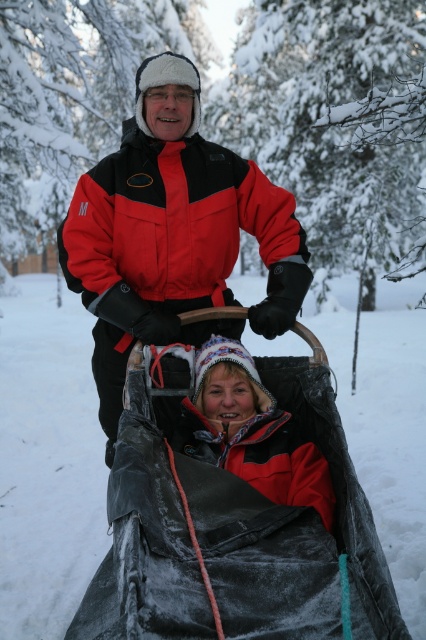
Question: Is velvet black blanket at lower center below red/black jacket at center?

Choices:
 (A) no
 (B) yes

Answer: (B)

Question: Which object is closer to the camera taking this photo?

Choices:
 (A) red/black jacket at center
 (B) matte red jacket at center
 (C) velvet black blanket at lower center

Answer: (C)

Question: Can you confirm if red/black jacket at center is wider than matte red jacket at center?

Choices:
 (A) yes
 (B) no

Answer: (A)

Question: Which point is closer to the camera taking this photo?

Choices:
 (A) (221, 371)
 (B) (169, 250)

Answer: (A)

Question: Is velvet black blanket at lower center further to the viewer compared to red/black jacket at center?

Choices:
 (A) yes
 (B) no

Answer: (B)

Question: Among these points, which one is nearest to the camera?

Choices:
 (A) (226, 268)
 (B) (189, 616)

Answer: (B)